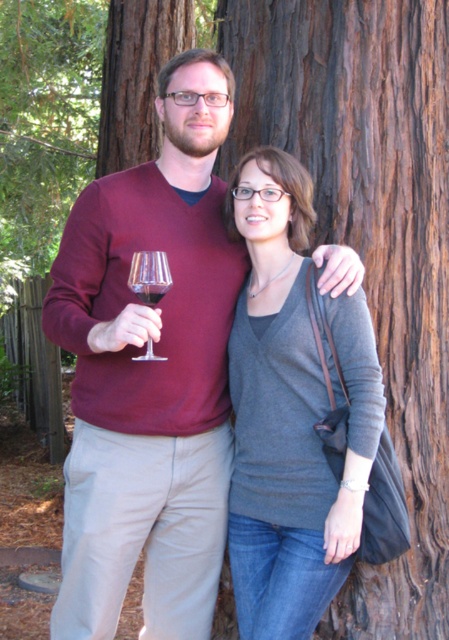
Is point (110, 200) closer to camera compared to point (162, 285)?

That is False.

Between maroon sweater at center and transparent glass at left, which one has less height?

transparent glass at left is shorter.

The height and width of the screenshot is (640, 449). Describe the element at coordinates (149, 372) in the screenshot. I see `maroon sweater at center` at that location.

Find the location of a particular element. Image resolution: width=449 pixels, height=640 pixels. maroon sweater at center is located at coordinates (149, 372).

Between matte gray sweater at center and transparent glass at left, which one has less height?

With less height is transparent glass at left.

Is point (338, 396) farther from camera compared to point (158, 358)?

That is True.

What do you see at coordinates (290, 412) in the screenshot? Image resolution: width=449 pixels, height=640 pixels. I see `matte gray sweater at center` at bounding box center [290, 412].

Where is `matte gray sweater at center`? Image resolution: width=449 pixels, height=640 pixels. matte gray sweater at center is located at coordinates click(x=290, y=412).

Who is taller, transparent glass at left or translucent glass at center?

With more height is transparent glass at left.

Does transparent glass at left have a smaller size compared to translucent glass at center?

No, transparent glass at left is not smaller than translucent glass at center.

The height and width of the screenshot is (640, 449). What do you see at coordinates (149, 276) in the screenshot? I see `transparent glass at left` at bounding box center [149, 276].

Where is `transparent glass at left`? Image resolution: width=449 pixels, height=640 pixels. transparent glass at left is located at coordinates (149, 276).